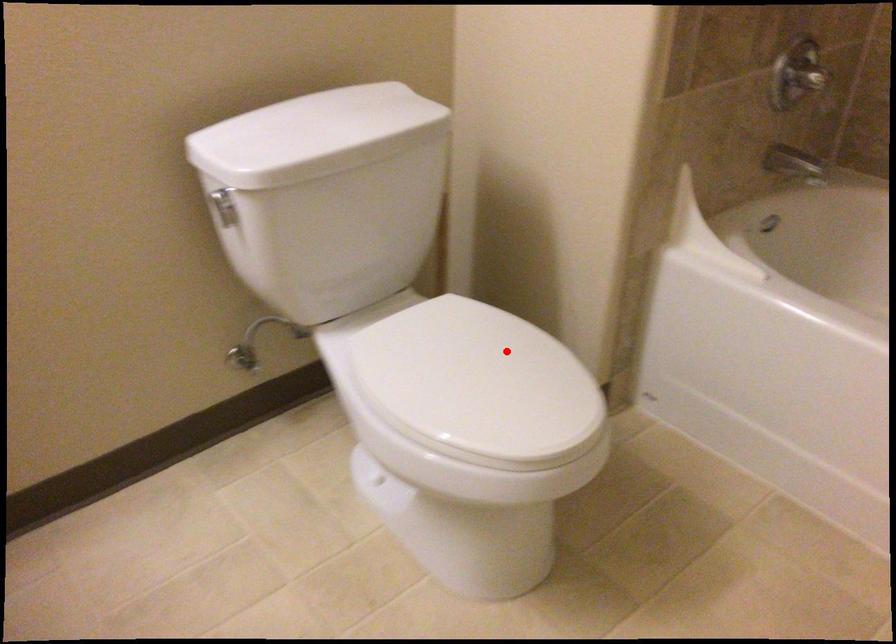
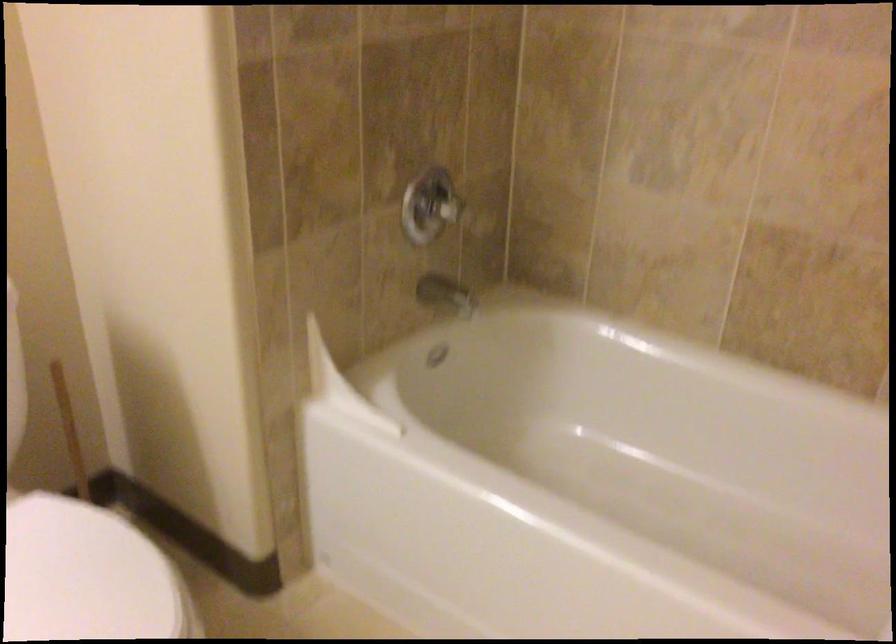
Question: I am providing you with two images of the same scene from different viewpoints. Image1 has a red point marked. In image2, the corresponding 3D location appears at what relative position? Reply with the corresponding letter.

Choices:
 (A) Closer
 (B) Farther

Answer: (A)